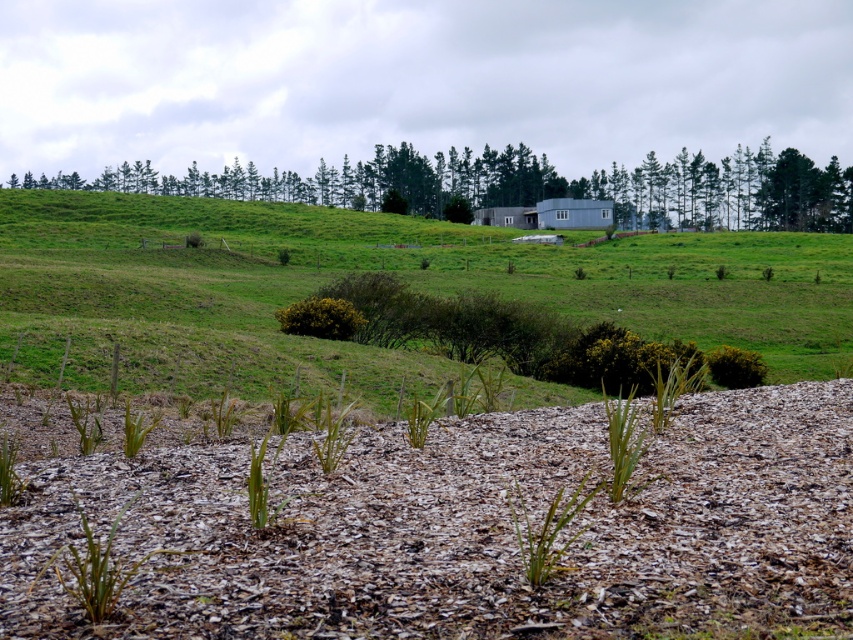
Question: Which point is closer to the camera taking this photo?

Choices:
 (A) (245, 164)
 (B) (462, 513)

Answer: (B)

Question: Observing the image, what is the correct spatial positioning of brown mulch at center in reference to green leafy tree at upper center?

Choices:
 (A) left
 (B) right

Answer: (B)

Question: From the image, what is the correct spatial relationship of green grassy hillside at upper center in relation to green leafy tree at upper center?

Choices:
 (A) left
 (B) right

Answer: (B)

Question: Which object is closer to the camera taking this photo?

Choices:
 (A) green grassy hillside at upper center
 (B) green leafy tree at upper center
 (C) brown mulch at center

Answer: (C)

Question: Is brown mulch at center closer to camera compared to green grassy hillside at upper center?

Choices:
 (A) no
 (B) yes

Answer: (B)

Question: Which object is farther from the camera taking this photo?

Choices:
 (A) green grassy hillside at upper center
 (B) brown mulch at center

Answer: (A)